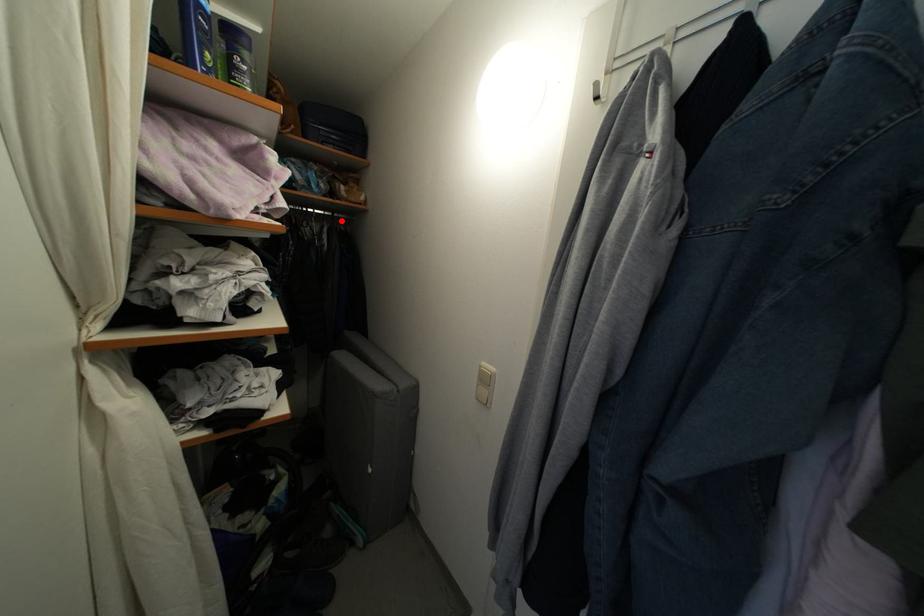
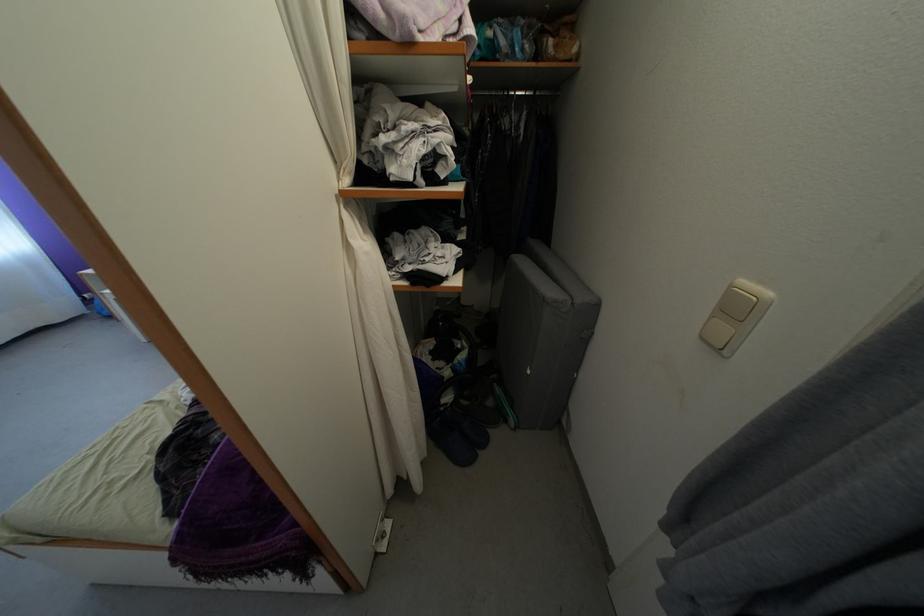
Locate, in the second image, the point that corresponds to the highlighted location in the first image.

(543, 98)